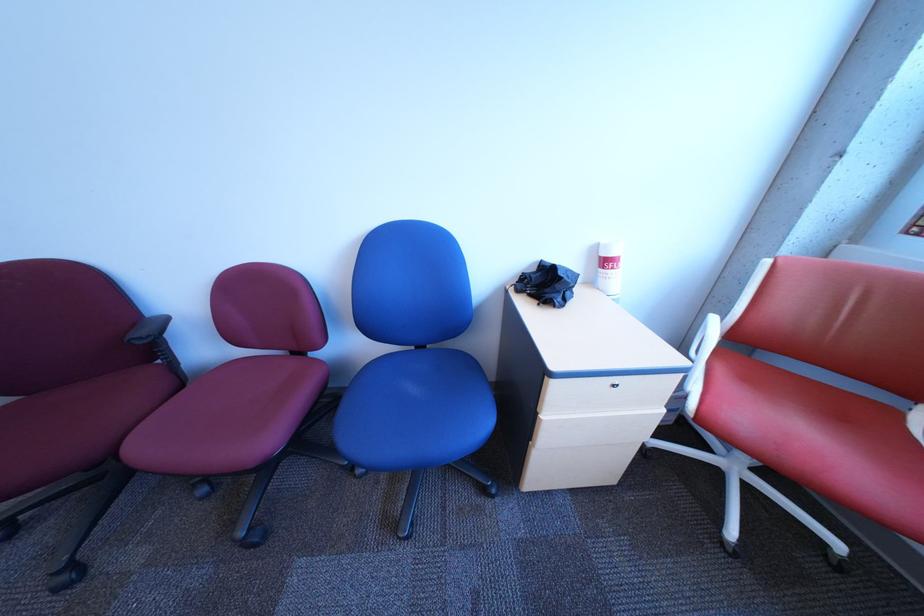
Where is `black chair armrest`? black chair armrest is located at coordinates (150, 333).